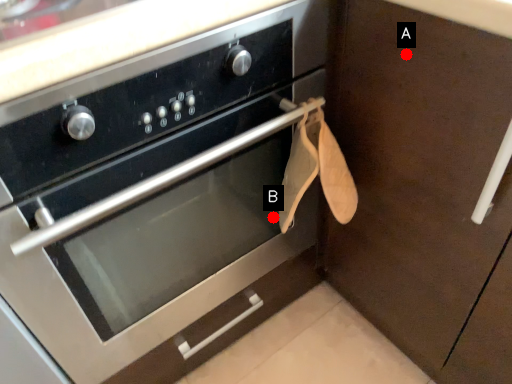
Question: Two points are circled on the image, labeled by A and B beside each circle. Which point is closer to the camera taking this photo?

Choices:
 (A) A is closer
 (B) B is closer

Answer: (A)